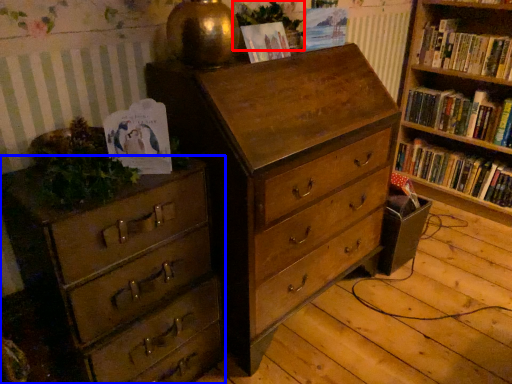
Question: Which point is closer to the camera, plant (highlighted by a red box) or chest of drawers (highlighted by a blue box)?

Choices:
 (A) plant
 (B) chest of drawers

Answer: (B)